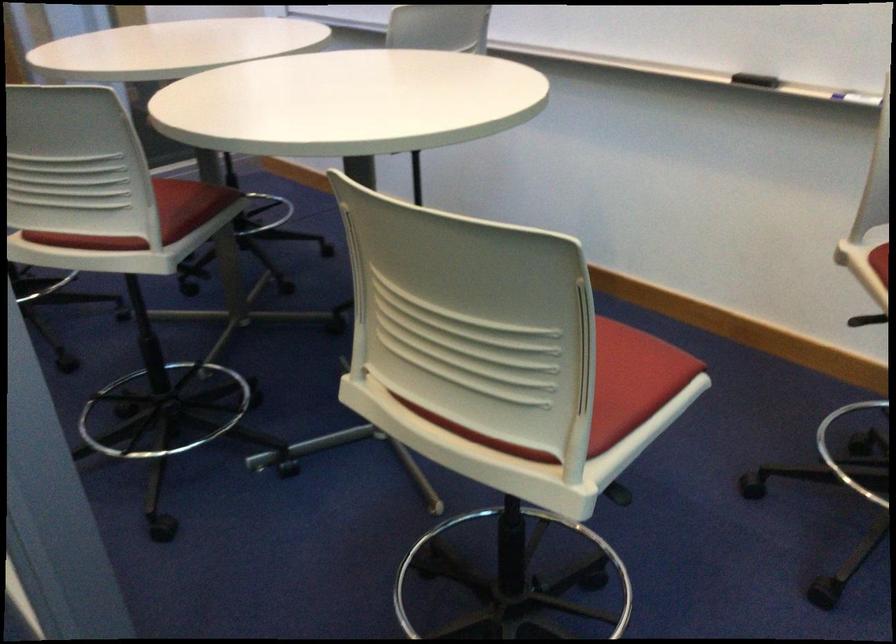
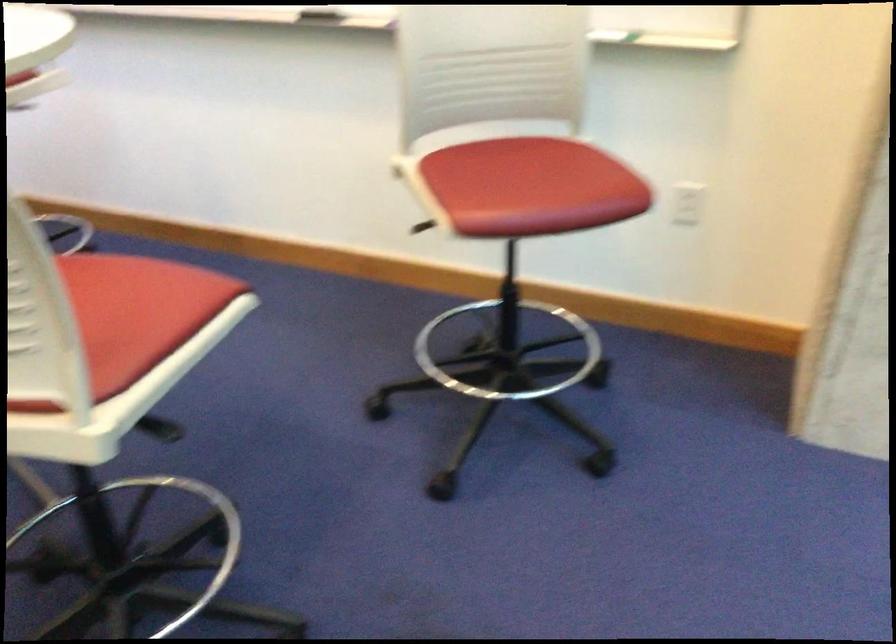
Question: The camera is either moving clockwise (left) or counter-clockwise (right) around the object. The first image is from the beginning of the video and the second image is from the end. Is the camera moving left or right when shooting the video?

Choices:
 (A) Left
 (B) Right

Answer: (A)